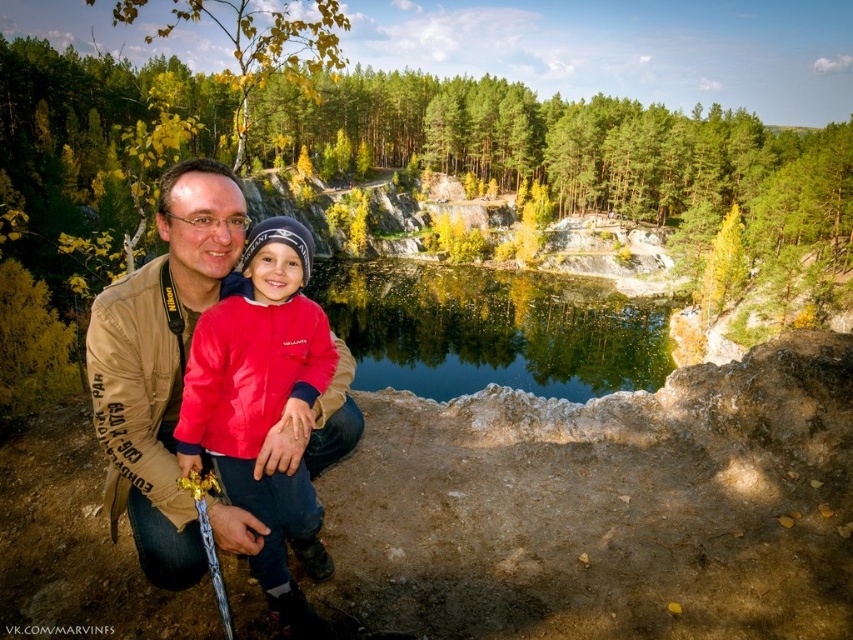
Question: Which object is closer to the camera taking this photo?

Choices:
 (A) red fleece jacket at center
 (B) clear blue water at center

Answer: (A)

Question: Is clear blue water at center further to camera compared to red fleece jacket at center?

Choices:
 (A) yes
 (B) no

Answer: (A)

Question: Can you confirm if clear blue water at center is positioned below red fleece jacket at center?

Choices:
 (A) no
 (B) yes

Answer: (A)

Question: Which is nearer to the red fleece jacket at center?

Choices:
 (A) matte red jacket at center
 (B) clear blue water at center

Answer: (A)

Question: Is clear blue water at center to the right of matte red jacket at center from the viewer's perspective?

Choices:
 (A) yes
 (B) no

Answer: (A)

Question: Considering the real-world distances, which object is closest to the red fleece jacket at center?

Choices:
 (A) clear blue water at center
 (B) matte red jacket at center

Answer: (B)